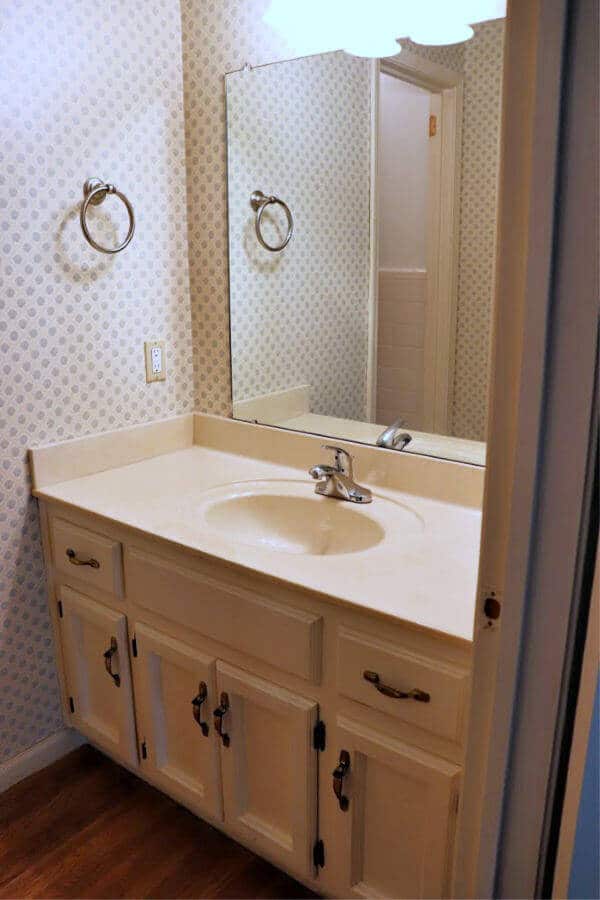
This screenshot has height=900, width=600. Identify the location of brown cabinet handle. (395, 697).